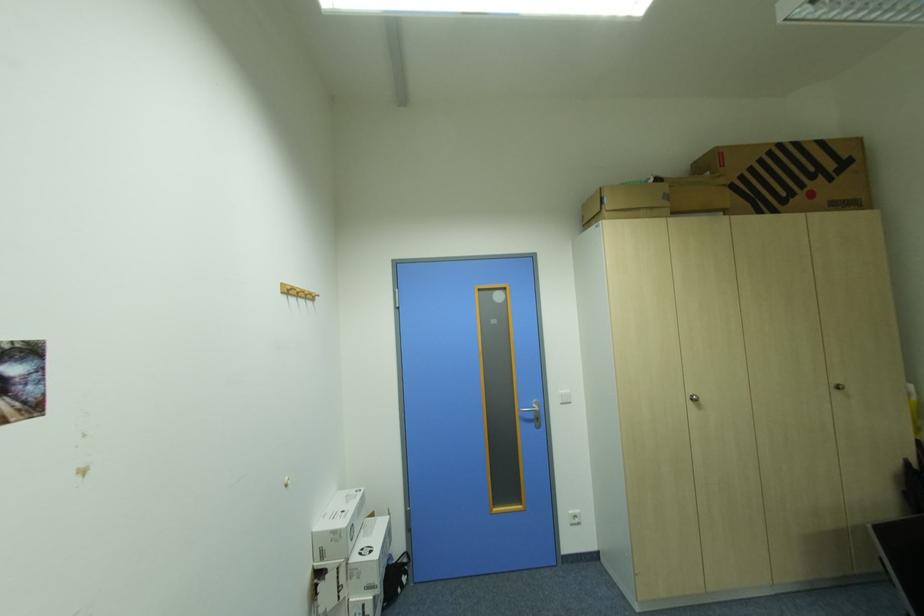
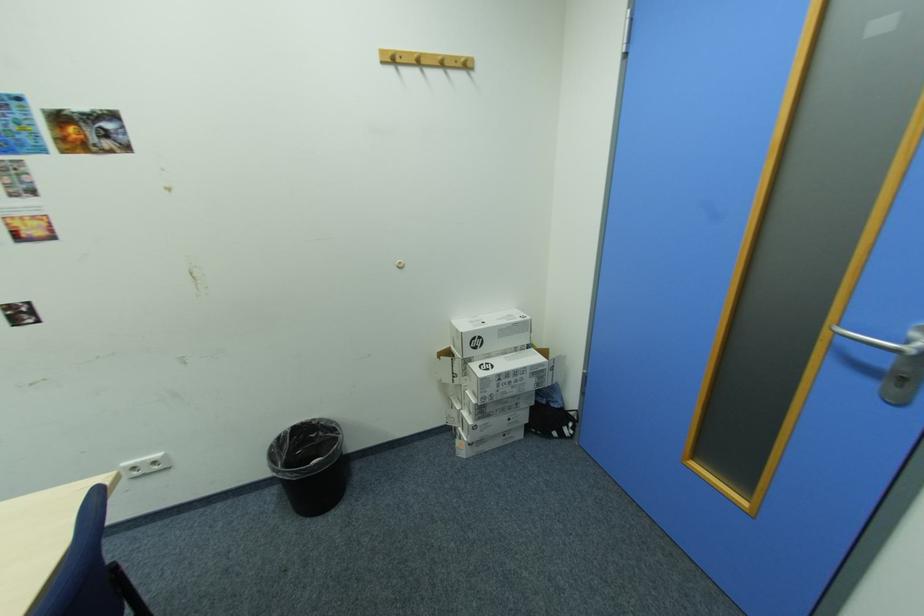
Find the pixel in the second image that matches point 341,533 in the first image.

(465, 331)